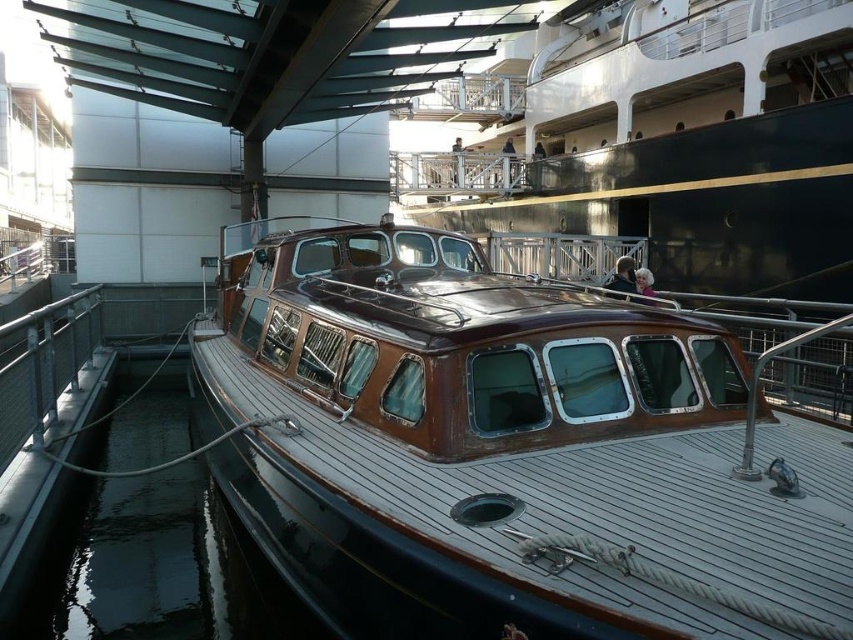
Which is behind, point (283, 440) or point (183, 476)?

The point (183, 476) is behind.

Is point (321, 243) positioned after point (57, 602)?

Yes, point (321, 243) is behind point (57, 602).

Which is behind, point (523, 621) or point (71, 604)?

Positioned behind is point (71, 604).

Locate an element on the screen. wooden boat at center is located at coordinates (508, 451).